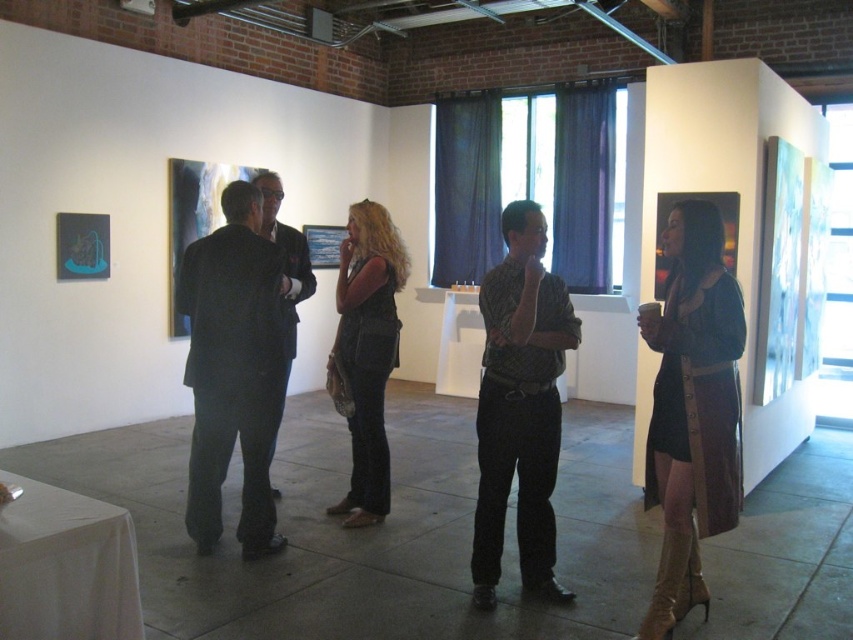
Question: Among these points, which one is farthest from the camera?

Choices:
 (A) (535, 577)
 (B) (387, 276)
 (C) (242, 512)

Answer: (B)

Question: Is dark green textured shirt at center to the left of dark gray suit at center from the viewer's perspective?

Choices:
 (A) no
 (B) yes

Answer: (A)

Question: From the image, what is the correct spatial relationship of denim vest at center in relation to dark gray suit at center?

Choices:
 (A) above
 (B) below

Answer: (B)

Question: Among these points, which one is farthest from the camera?

Choices:
 (A) (721, 525)
 (B) (509, 256)
 (C) (372, 413)
 (D) (241, 340)

Answer: (C)

Question: Which object is the closest to the dark gray suit at left?

Choices:
 (A) dark green textured shirt at center
 (B) leather dress at center
 (C) dark gray suit at center
 (D) denim vest at center

Answer: (C)

Question: Is dark green textured shirt at center below denim vest at center?

Choices:
 (A) yes
 (B) no

Answer: (A)